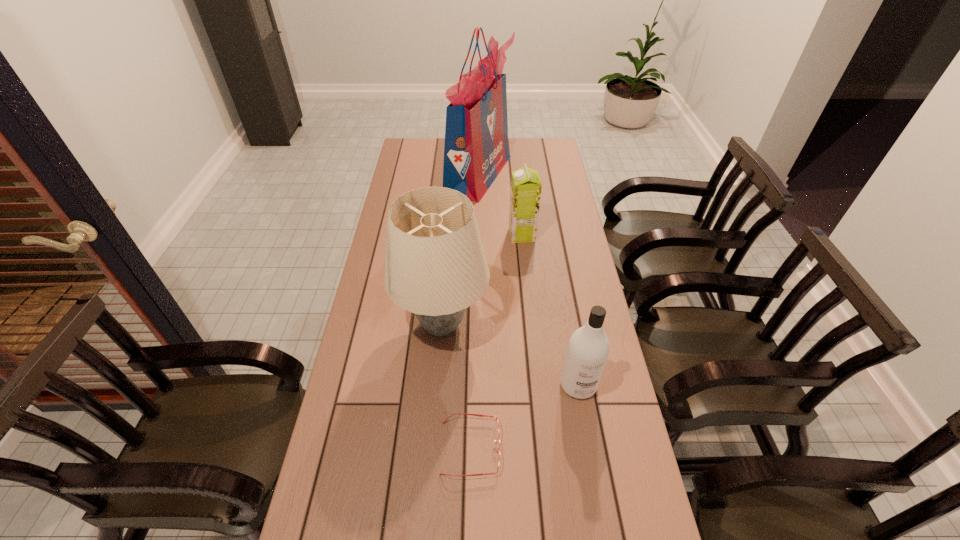
Find the location of a particular element. Image resolution: width=960 pixels, height=540 pixels. free region located 0.160m on the back of the third nearest object is located at coordinates (447, 258).

Identify the location of vacant space located on the front-facing side of the fourth farthest object. The height and width of the screenshot is (540, 960). (605, 536).

Where is `free region located on the back of the soya milk`? The height and width of the screenshot is (540, 960). free region located on the back of the soya milk is located at coordinates (516, 176).

At what (x,y) coordinates should I click in order to perform the action: click on vacant space located 0.100m on the lenses of the spectacles. Please return your answer as a coordinate pair (x, y). This screenshot has width=960, height=540. Looking at the image, I should click on (540, 448).

The height and width of the screenshot is (540, 960). In order to click on object at the far edge in this screenshot , I will do `click(476, 149)`.

Find the location of a particular element. The height and width of the screenshot is (540, 960). object located in the left edge section of the desktop is located at coordinates (435, 266).

Identify the location of object that is positioned at the right edge. (588, 348).

At what (x,y) coordinates should I click in order to perform the action: click on vacant space at the far edge. Please return your answer as a coordinate pair (x, y). This screenshot has height=540, width=960. Looking at the image, I should click on (511, 146).

In the image, there is a desktop. Where is `vacant space at the left edge`? vacant space at the left edge is located at coordinates (372, 285).

The width and height of the screenshot is (960, 540). In the image, there is a desktop. In order to click on vacant area at the right edge in this screenshot , I will do `click(627, 471)`.